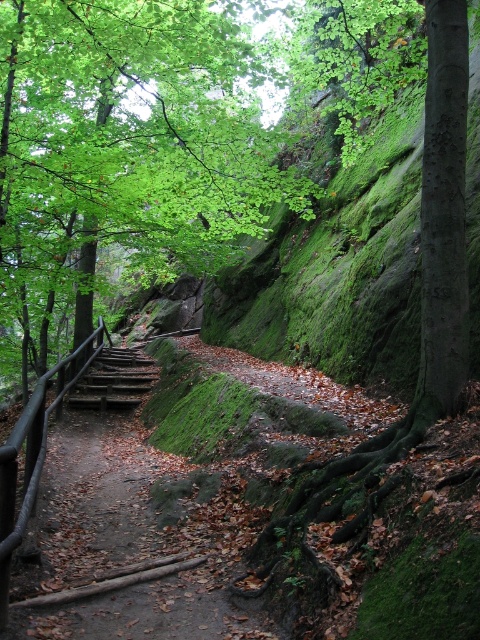
Question: Is dirt path at center smaller than rustic wooden stairs at center-left?

Choices:
 (A) yes
 (B) no

Answer: (B)

Question: Can you confirm if green leafy tree at center is wider than rustic wooden stairs at center-left?

Choices:
 (A) no
 (B) yes

Answer: (B)

Question: Among these points, which one is farthest from the camera?

Choices:
 (A) (141, 355)
 (B) (165, 624)

Answer: (A)

Question: Which point is farther from the camera taking this photo?

Choices:
 (A) (112, 349)
 (B) (157, 58)
 (C) (156, 474)

Answer: (A)

Question: Among these points, which one is nearest to the camera?

Choices:
 (A) (247, 188)
 (B) (59, 380)

Answer: (A)

Question: Is green leafy tree at center wider than dirt path at center?

Choices:
 (A) no
 (B) yes

Answer: (B)